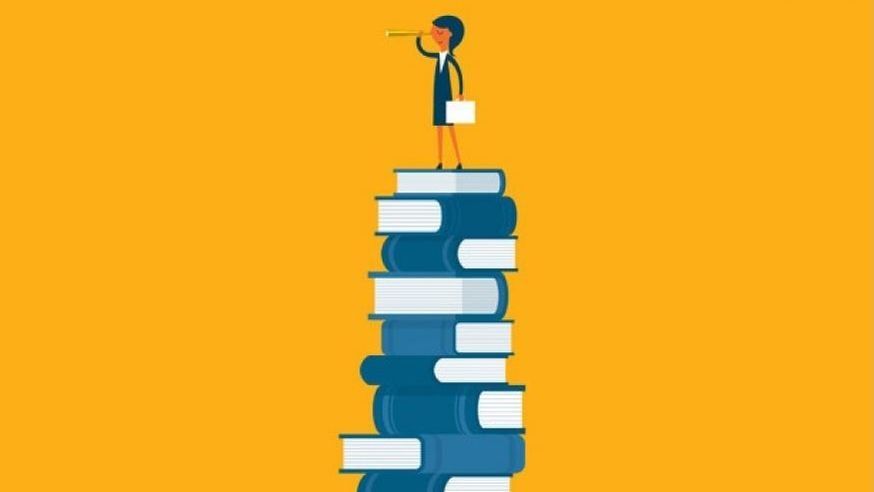
At what (x,y) coordinates should I click in order to perform the action: click on books with spines that feature stripes. Please return your answer as a coordinate pair (x, y). Looking at the image, I should click on (417, 483), (467, 456), (420, 411), (421, 332), (431, 256), (473, 216).